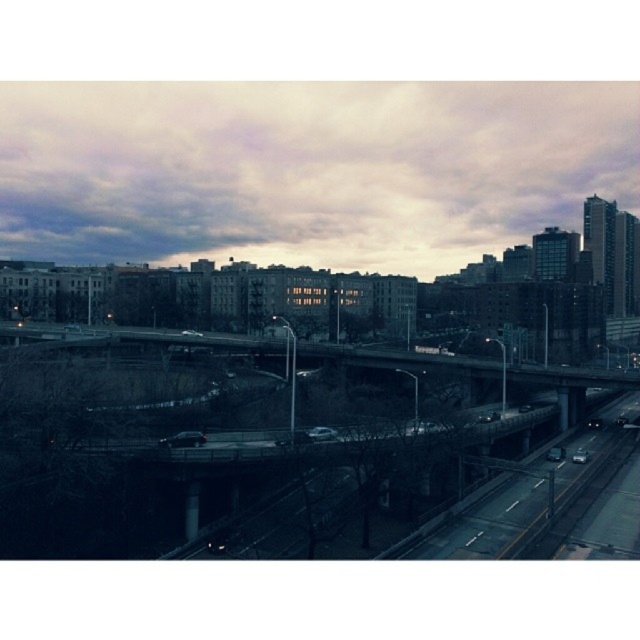
You are standing on the elevated highway and looking up at the cloudy sky at upper center. If you want to throw a small ball straight up into the air, how high will the ball go before it starts to fall back down?

The cloudy sky at upper center is 275.69 meters away from the camera. However, when you throw a ball straight up, its maximum height depends on the initial velocity and gravity. Without knowing the throw force, it is impossible to determine the exact height. But the ball will not reach the cloudy sky at upper center because 275.69 meters is an extremely high distance for a human throw.

From the picture: You are a photographer trying to capture the cloudy sky at upper center and the concrete bridge at center in the same frame. Which object should you adjust your camera to focus on first if you want to include both in your shot?

The concrete bridge at center is positioned on the left side of cloudy sky at upper center, so you should focus on the cloudy sky at upper center first to ensure both objects are in frame.